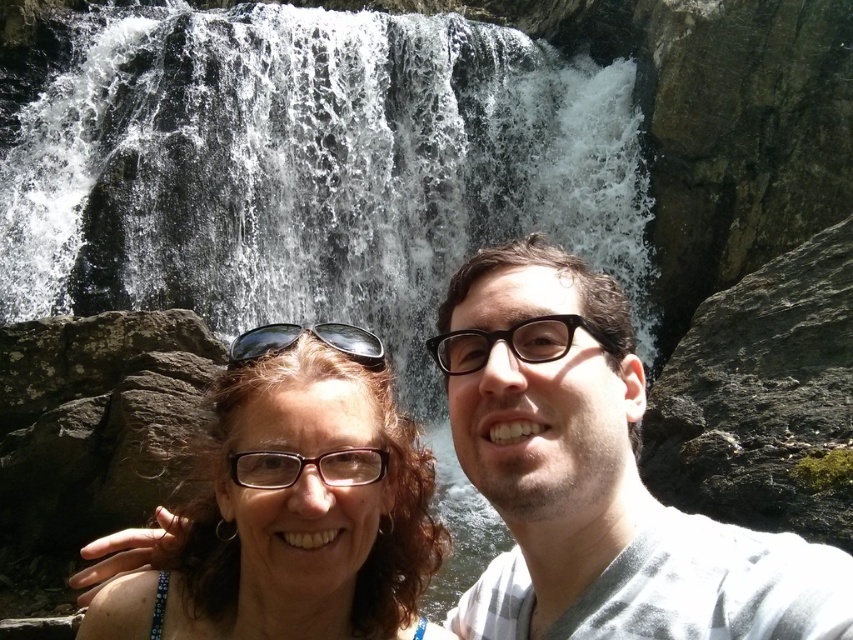
Who is higher up, smooth gray shirt at center or matte brown hair at center?

Positioned higher is smooth gray shirt at center.

Identify the location of smooth gray shirt at center. Image resolution: width=853 pixels, height=640 pixels. (596, 477).

You are a GUI agent. You are given a task and a screenshot of the screen. Output one action in this format:
    pyautogui.click(x=<x>, y=<y>)
    Task: Click on the smooth gray shirt at center
    Image resolution: width=853 pixels, height=640 pixels.
    Given the screenshot: What is the action you would take?
    pyautogui.click(x=596, y=477)

Measure the distance from smooth gray shirt at center to black reflective sunglasses at center.

smooth gray shirt at center is 9.13 meters from black reflective sunglasses at center.

Is point (587, 506) positioned behind point (341, 339)?

No, it is in front of (341, 339).

Image resolution: width=853 pixels, height=640 pixels. What are the coordinates of `smooth gray shirt at center` in the screenshot? It's located at (x=596, y=477).

How much distance is there between white frothy water at center and smooth gray shirt at center?

white frothy water at center is 23.60 meters away from smooth gray shirt at center.

Which is above, white frothy water at center or smooth gray shirt at center?

white frothy water at center is above.

Find the location of a particular element. This screenshot has width=853, height=640. white frothy water at center is located at coordinates [x=310, y=170].

I want to click on white frothy water at center, so click(x=310, y=170).